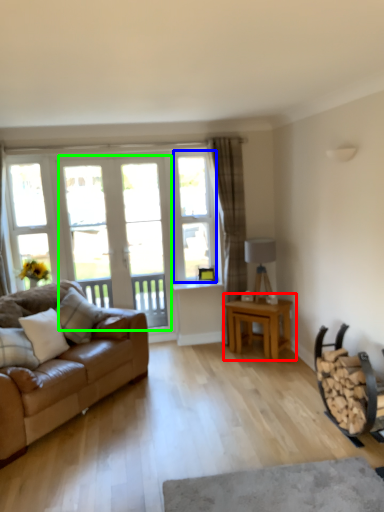
Question: Which is nearer to the table (highlighted by a red box)? window (highlighted by a blue box) or screen door (highlighted by a green box).

Choices:
 (A) window
 (B) screen door

Answer: (A)